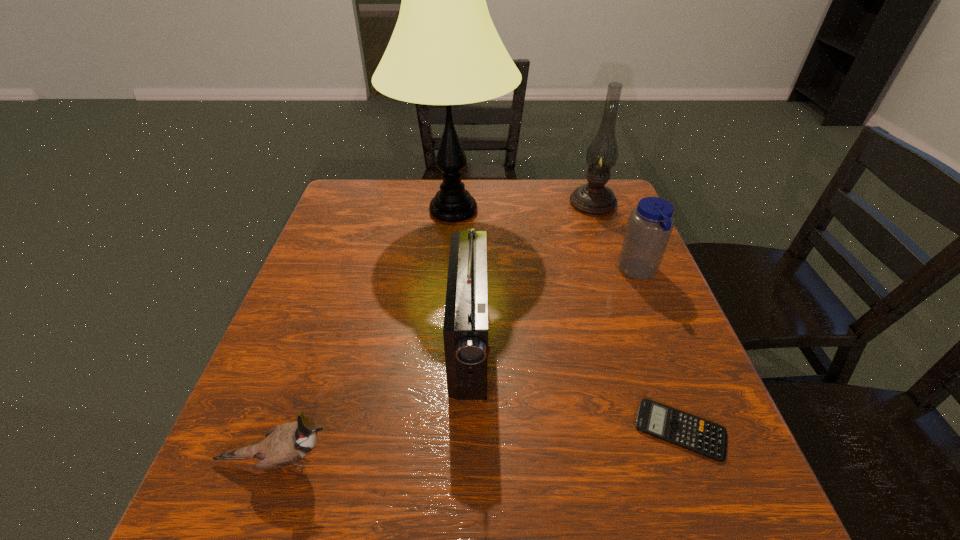
Image resolution: width=960 pixels, height=540 pixels. In order to click on free space between the fifth shortest object and the radio receiver in this screenshot , I will do `click(531, 273)`.

Where is `vacant area that lies between the radio receiver and the bird`? This screenshot has height=540, width=960. vacant area that lies between the radio receiver and the bird is located at coordinates (373, 402).

Find the location of a particular element. The height and width of the screenshot is (540, 960). vacant area between the fifth tallest object and the fourth shortest object is located at coordinates 373,402.

I want to click on vacant space that is in between the radio receiver and the second tallest object, so click(531, 273).

I want to click on free space between the calculator and the fifth shortest object, so click(x=636, y=316).

Locate an element on the screen. The height and width of the screenshot is (540, 960). free space between the radio receiver and the second shortest object is located at coordinates (373, 402).

Locate an element on the screen. free space between the fourth tallest object and the tallest object is located at coordinates (546, 241).

Find the location of a particular element. The height and width of the screenshot is (540, 960). vacant point located between the bird and the calculator is located at coordinates (479, 446).

The height and width of the screenshot is (540, 960). What are the coordinates of `vacant point located between the radio receiver and the water bottle` in the screenshot? It's located at (554, 308).

I want to click on object that is the second closest to the water bottle, so click(445, 50).